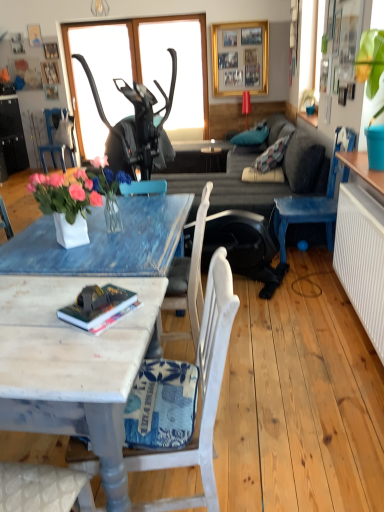
Question: From the image's perspective, is wooden marble coffee table at lower left above or below white ceramic vase at center?

Choices:
 (A) above
 (B) below

Answer: (B)

Question: In terms of width, does wooden marble coffee table at lower left look wider or thinner when compared to white ceramic vase at center?

Choices:
 (A) wide
 (B) thin

Answer: (A)

Question: Based on their relative distances, which object is nearer to the wooden marble coffee table at lower left?

Choices:
 (A) blue painted wood chair at right, the third chair in the left-to-right sequence
 (B) transparent glass window at upper center
 (C) dark gray fabric couch at center
 (D) white ceramic vase at center
 (E) matte black side table at center

Answer: (D)

Question: Considering the real-world distances, which object is closest to the dark gray fabric couch at center?

Choices:
 (A) white painted wood chair at lower center, which appears as the 2th chair when viewed from the right
 (B) white ceramic vase at center
 (C) transparent glass window at upper center
 (D) blue painted wood chair at right, which is the 2th chair from back to front
 (E) gold metallic picture frame at upper center

Answer: (D)